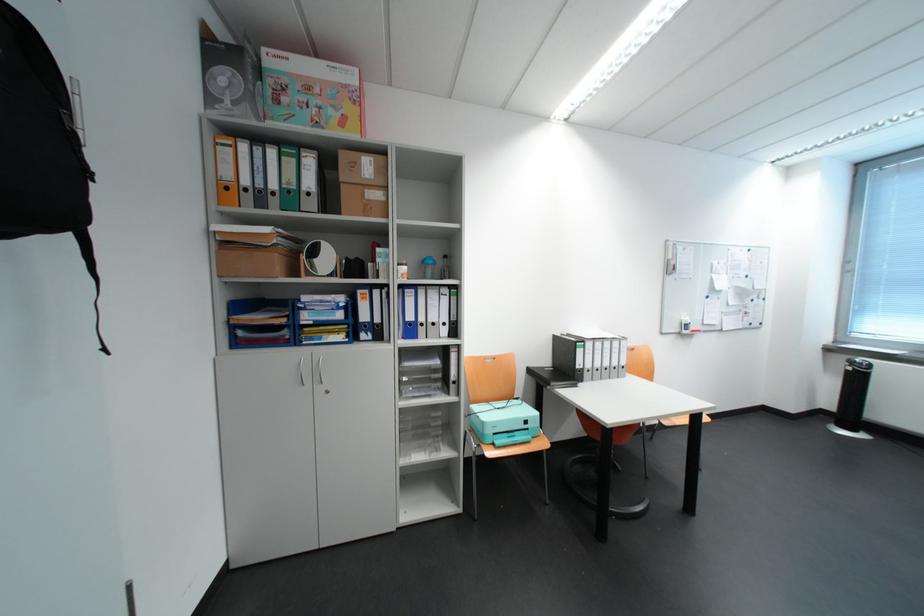
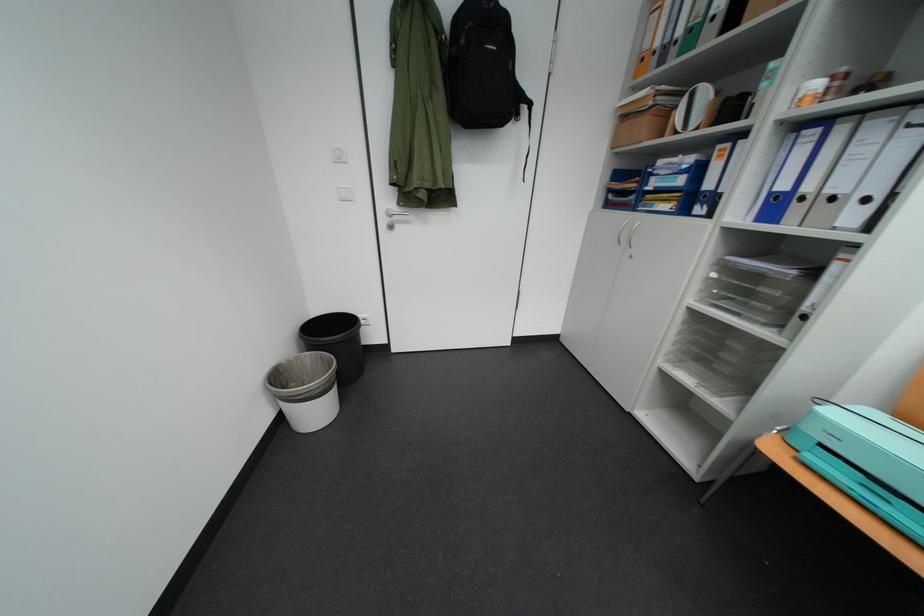
In the second image, find the point that corresponds to point (502, 454) in the first image.

(784, 451)